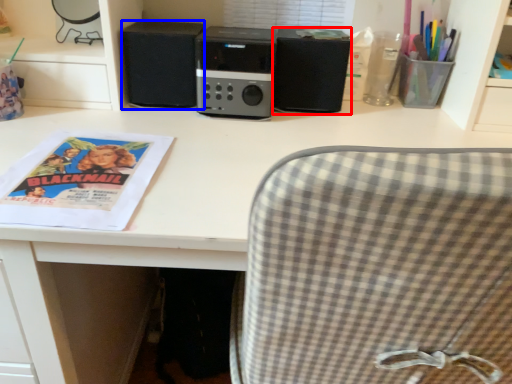
Question: Which of the following is the farthest to the observer, speaker (highlighted by a red box) or speaker (highlighted by a blue box)?

Choices:
 (A) speaker
 (B) speaker

Answer: (B)